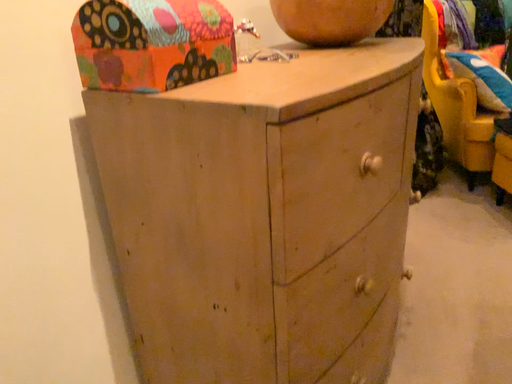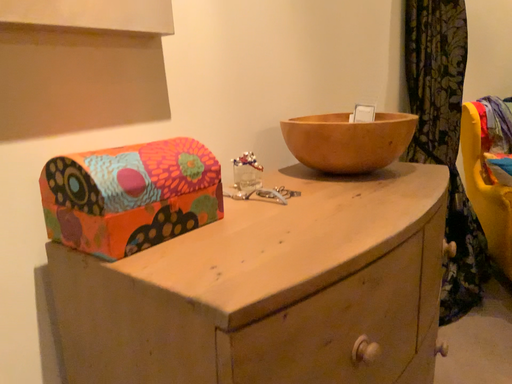
Question: How did the camera likely rotate when shooting the video?

Choices:
 (A) rotated downward
 (B) rotated upward

Answer: (B)